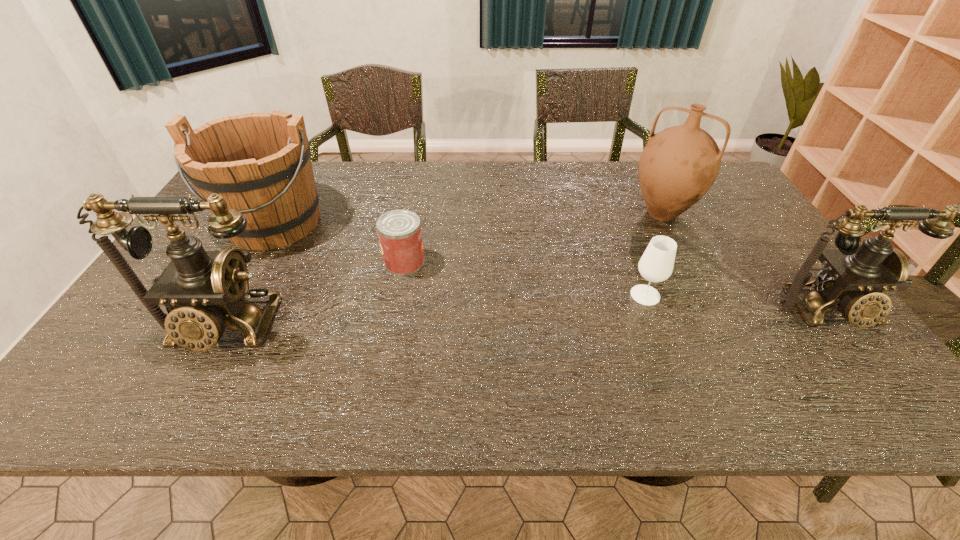
You are a GUI agent. You are given a task and a screenshot of the screen. Output one action in this format:
    pyautogui.click(x=<x>, y=<y>)
    Task: Click on the left telephone
    This screenshot has width=960, height=540.
    Given the screenshot: What is the action you would take?
    pyautogui.click(x=202, y=291)

Where is `the shorter telephone`? the shorter telephone is located at coordinates (853, 277).

The image size is (960, 540). I want to click on the right telephone, so click(853, 277).

Where is `the second object from right to left`? Image resolution: width=960 pixels, height=540 pixels. the second object from right to left is located at coordinates (678, 166).

Locate an element on the screen. the fourth object from right to left is located at coordinates (399, 231).

Identify the location of can. (399, 231).

The height and width of the screenshot is (540, 960). Find the location of `wine bucket`. wine bucket is located at coordinates (260, 163).

Identify the location of glass. (656, 264).

The width and height of the screenshot is (960, 540). In order to click on the second shortest object in this screenshot , I will do `click(656, 264)`.

Locate an element on the screen. The width and height of the screenshot is (960, 540). free location located 0.140m on the back of the pitcher is located at coordinates (641, 172).